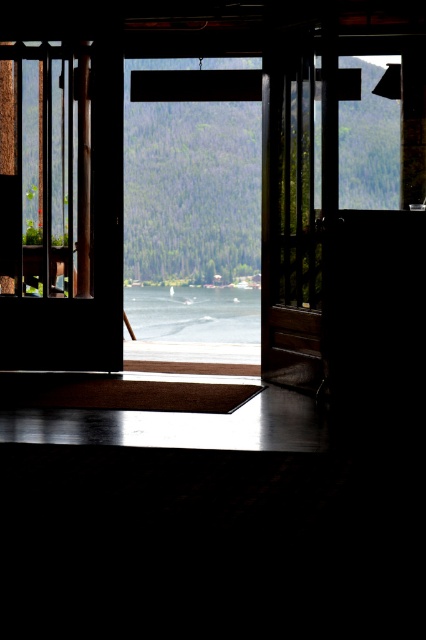
Between transparent glass door at left and wooden door at center, which one has more height?

transparent glass door at left is taller.

Is point (121, 344) positioned behind point (261, 81)?

No, (121, 344) is closer to viewer.

Does point (66, 176) lie in front of point (268, 131)?

No, (66, 176) is further to viewer.

This screenshot has height=640, width=426. Find the location of `transparent glass door at left`. transparent glass door at left is located at coordinates (60, 205).

From the picture: Can you confirm if transparent glass window at center is taller than clear water at center?

Yes.

Between transparent glass window at center and clear water at center, which one appears on the right side from the viewer's perspective?

From the viewer's perspective, transparent glass window at center appears more on the right side.

What do you see at coordinates (190, 214) in the screenshot?
I see `transparent glass window at center` at bounding box center [190, 214].

At what (x,y) coordinates should I click in order to perform the action: click on transparent glass window at center. Please return your answer as a coordinate pair (x, y). Looking at the image, I should click on (190, 214).

Who is positioned more to the right, transparent glass door at left or transparent glass window at center?

transparent glass window at center

Find the location of a particular element. This screenshot has height=640, width=426. transparent glass door at left is located at coordinates point(60,205).

Where is `transparent glass door at left`? This screenshot has width=426, height=640. transparent glass door at left is located at coordinates (60, 205).